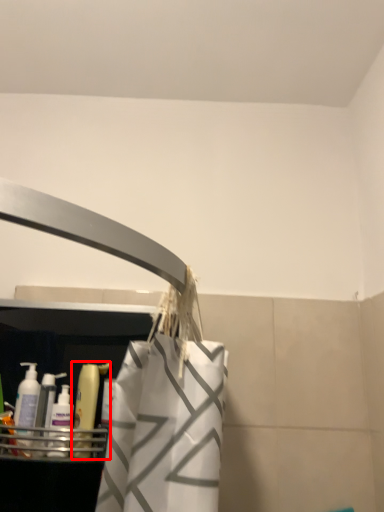
Question: From the image's perspective, considering the relative positions of cleaning product (annotated by the red box) and cleaning product in the image provided, where is cleaning product (annotated by the red box) located with respect to the staircase?

Choices:
 (A) below
 (B) above

Answer: (B)